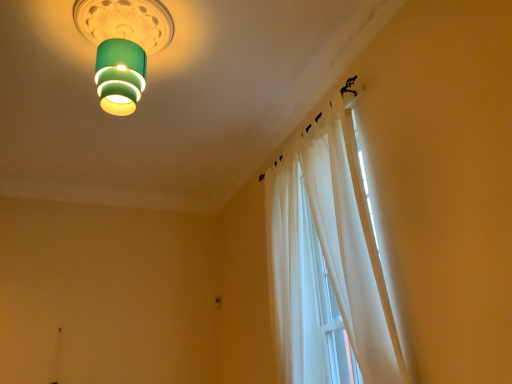
Measure the distance between point (x=346, y=173) and camera.

Point (x=346, y=173) and camera are 2.37 meters apart.

This screenshot has width=512, height=384. Describe the element at coordinates (328, 252) in the screenshot. I see `white sheer curtain at upper right` at that location.

The height and width of the screenshot is (384, 512). In order to click on white sheer curtain at upper right in this screenshot , I will do `click(328, 252)`.

At what (x,y) coordinates should I click in order to perform the action: click on green matte lampshade at upper center. Please return your answer as a coordinate pair (x, y). The width and height of the screenshot is (512, 384). Looking at the image, I should click on (123, 45).

This screenshot has height=384, width=512. What do you see at coordinates (123, 45) in the screenshot?
I see `green matte lampshade at upper center` at bounding box center [123, 45].

What is the approximate height of green matte lampshade at upper center?

22.86 inches.

Find the location of a particular element. The image size is (512, 384). white sheer curtain at upper right is located at coordinates (328, 252).

Which object is positioned more to the right, white sheer curtain at upper right or green matte lampshade at upper center?

From the viewer's perspective, white sheer curtain at upper right appears more on the right side.

In the scene shown: Does white sheer curtain at upper right come behind green matte lampshade at upper center?

No.

Is point (354, 284) behind point (109, 33)?

That is False.

From the image's perspective, is white sheer curtain at upper right above or below green matte lampshade at upper center?

Clearly, from the image's perspective, white sheer curtain at upper right is below green matte lampshade at upper center.

From a real-world perspective, is white sheer curtain at upper right physically below green matte lampshade at upper center?

Yes, from a real-world perspective, white sheer curtain at upper right is under green matte lampshade at upper center.

Which object is thinner, white sheer curtain at upper right or green matte lampshade at upper center?

white sheer curtain at upper right is thinner.

From their relative heights in the image, would you say white sheer curtain at upper right is taller or shorter than green matte lampshade at upper center?

white sheer curtain at upper right is taller than green matte lampshade at upper center.

Does white sheer curtain at upper right have a smaller size compared to green matte lampshade at upper center?

No, white sheer curtain at upper right is not smaller than green matte lampshade at upper center.

Is green matte lampshade at upper center inside white sheer curtain at upper right?

No, white sheer curtain at upper right does not contain green matte lampshade at upper center.

Would you consider white sheer curtain at upper right to be distant from green matte lampshade at upper center?

Yes.

Does white sheer curtain at upper right turn towards green matte lampshade at upper center?

Yes.

Measure the distance between white sheer curtain at upper right and green matte lampshade at upper center.

white sheer curtain at upper right and green matte lampshade at upper center are 4.32 feet apart from each other.

Where is `lamp behind the white sheer curtain at upper right`? lamp behind the white sheer curtain at upper right is located at coordinates (123, 45).

Consider the image. Which is more to the left, green matte lampshade at upper center or white sheer curtain at upper right?

From the viewer's perspective, green matte lampshade at upper center appears more on the left side.

Relative to white sheer curtain at upper right, is green matte lampshade at upper center in front or behind?

green matte lampshade at upper center is positioned farther from the viewer than white sheer curtain at upper right.

Considering the points (158, 49) and (319, 231), which point is in front, point (158, 49) or point (319, 231)?

The point (319, 231) is more forward.

From the image's perspective, is green matte lampshade at upper center positioned above or below white sheer curtain at upper right?

green matte lampshade at upper center is above white sheer curtain at upper right.

Consider the image. From a real-world perspective, is green matte lampshade at upper center below white sheer curtain at upper right?

No, from a real-world perspective, green matte lampshade at upper center is not below white sheer curtain at upper right.

Considering the sizes of objects green matte lampshade at upper center and white sheer curtain at upper right in the image provided, who is thinner, green matte lampshade at upper center or white sheer curtain at upper right?

Thinner between the two is white sheer curtain at upper right.

Based on the photo, between green matte lampshade at upper center and white sheer curtain at upper right, which one has less height?

green matte lampshade at upper center.

Is green matte lampshade at upper center bigger or smaller than white sheer curtain at upper right?

Clearly, green matte lampshade at upper center is smaller in size than white sheer curtain at upper right.

Is green matte lampshade at upper center inside or outside of white sheer curtain at upper right?

green matte lampshade at upper center is not inside white sheer curtain at upper right, it's outside.

From the picture: Are green matte lampshade at upper center and white sheer curtain at upper right located far from each other?

Yes, green matte lampshade at upper center and white sheer curtain at upper right are located far from each other.

Is green matte lampshade at upper center oriented towards white sheer curtain at upper right?

No, green matte lampshade at upper center is not facing towards white sheer curtain at upper right.

How different are the orientations of green matte lampshade at upper center and white sheer curtain at upper right in degrees?

The angle between the facing direction of green matte lampshade at upper center and the facing direction of white sheer curtain at upper right is 83.4 degrees.

In order to click on curtain below the green matte lampshade at upper center (from the image's perspective) in this screenshot , I will do `click(328, 252)`.

Where is `curtain in front of the green matte lampshade at upper center`? The height and width of the screenshot is (384, 512). curtain in front of the green matte lampshade at upper center is located at coordinates tap(328, 252).

Image resolution: width=512 pixels, height=384 pixels. I want to click on lamp above the white sheer curtain at upper right (from a real-world perspective), so click(123, 45).